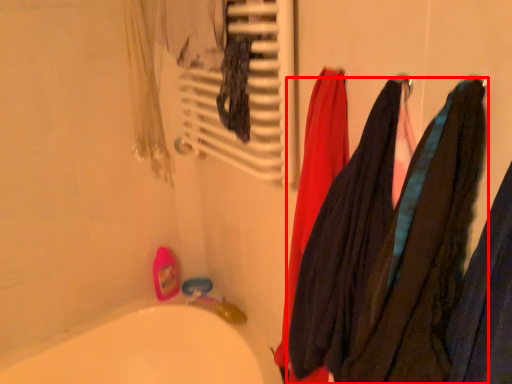
Question: Considering the relative positions of towel (annotated by the red box) and radiator in the image provided, where is towel (annotated by the red box) located with respect to the staircase?

Choices:
 (A) right
 (B) left

Answer: (A)